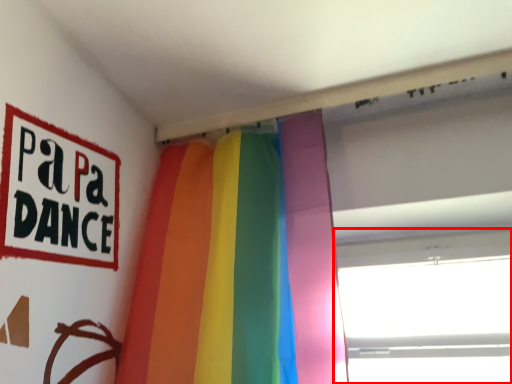
Question: From the image's perspective, where is window (annotated by the red box) located in relation to curtain in the image?

Choices:
 (A) above
 (B) below

Answer: (B)